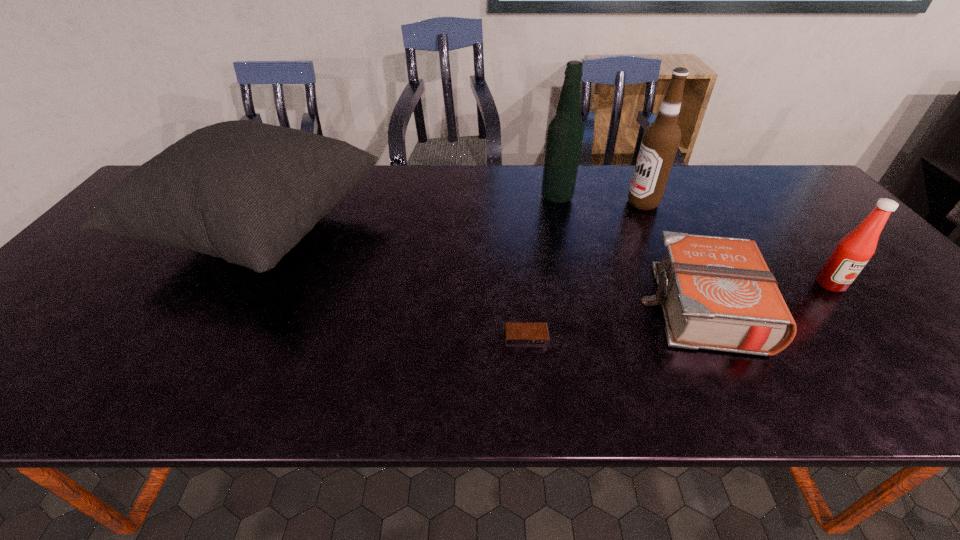
You are a GUI agent. You are given a task and a screenshot of the screen. Output one action in this format:
    pyautogui.click(x=<x>, y=<y>)
    Task: Click on the object situated at the far left corner
    This screenshot has height=540, width=960.
    Given the screenshot: What is the action you would take?
    pyautogui.click(x=248, y=192)

Image resolution: width=960 pixels, height=540 pixels. I want to click on vacant area at the far edge of the desktop, so click(x=726, y=165).

This screenshot has width=960, height=540. I want to click on vacant area that lies between the second object from left to right and the left alcohol, so (x=541, y=268).

Find the location of `vacant region between the alarm clock and the Bible`. vacant region between the alarm clock and the Bible is located at coordinates (615, 322).

Where is `vacant area that lies between the cushion and the Bible`? This screenshot has height=540, width=960. vacant area that lies between the cushion and the Bible is located at coordinates (484, 269).

Identify the location of free spot between the left alcohol and the leftmost object. (410, 215).

At what (x,y) coordinates should I click in order to perform the action: click on empty space between the third tallest object and the right alcohol. Please return your answer as a coordinate pair (x, y). This screenshot has height=540, width=960. Looking at the image, I should click on (453, 218).

I want to click on blank region between the second shortest object and the fifth object from right to left, so click(x=615, y=322).

Locate an element on the screen. free area in between the third object from left to right and the third tallest object is located at coordinates (410, 215).

This screenshot has width=960, height=540. What are the coordinates of `object that is the third closest one to the cushion` in the screenshot? It's located at (717, 293).